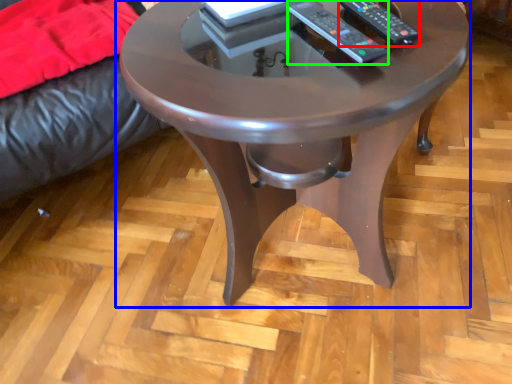
Question: Which object is the farthest from remote (highlighted by a red box)? Choose among these: coffee table (highlighted by a blue box) or remote (highlighted by a green box).

Choices:
 (A) coffee table
 (B) remote

Answer: (A)